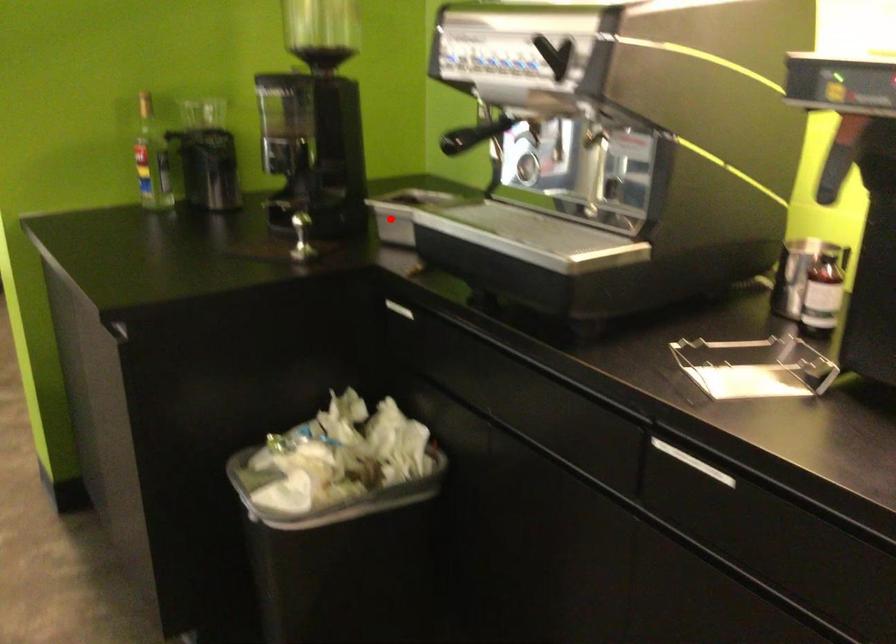
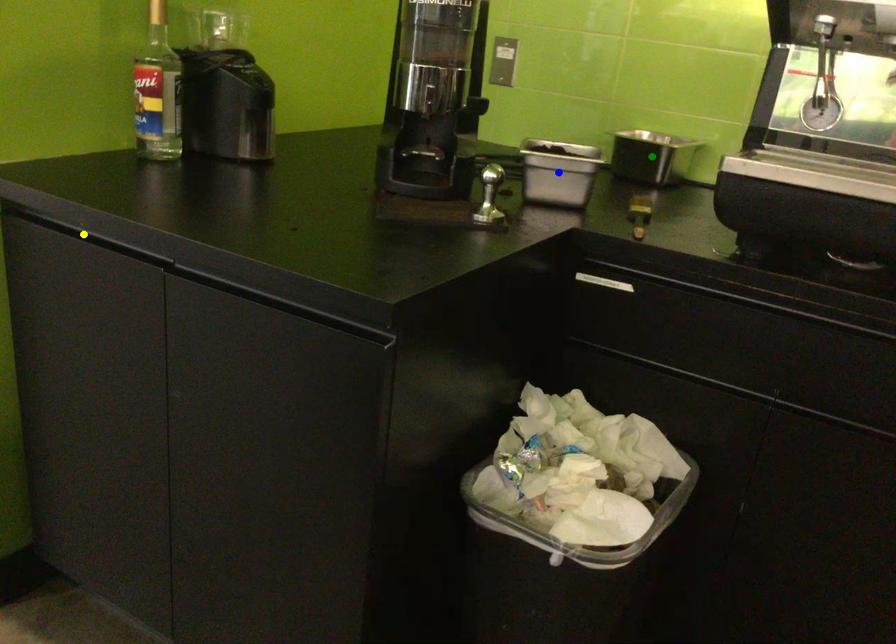
Question: I am providing you with two images of the same scene from different viewpoints. A red point is marked on the first image. You are given multiple points on the second image. Can you choose the point in image 2 that corresponds to the point in image 1?

Choices:
 (A) green point
 (B) blue point
 (C) yellow point

Answer: (B)